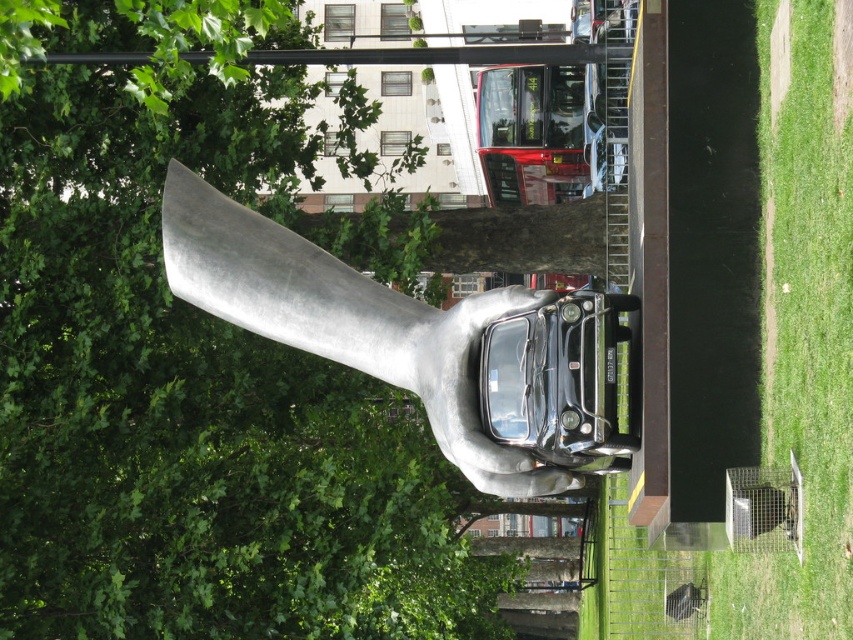
You are a drone operator planning to capture aerial footage of the public art installation. The drone has a maximum flight range of 30 meters. If you are positioned where the camera is, can the drone reach the green leafy tree at upper center to film it?

The distance between the green leafy tree at upper center and the camera is 33.32 meters, which exceeds the drone maximum flight range of 30 meters. Therefore, the drone cannot reach the green leafy tree at upper center.

Consider the image. You are a photographer standing at the camera position. You want to take a photo of the large metallic sculpture of a hand holding a vintage car and the green grass at lower right in the same frame. However, your camera has a maximum focus range of 25 meters. Will both objects be in focus?

The green grass at lower right is 25.26 meters away from camera, which exceeds the camera maximum focus range of 25 meters. Therefore, the green grass at lower right will be out of focus while the sculpture is within range, so both cannot be in focus simultaneously.

You are a photographer trying to capture the shiny silver hand at center holding the vintage car while also including the green leafy tree at upper center in the frame. Based on their positions, which object should you adjust your camera angle to focus on first to ensure both are in the shot?

The green leafy tree at upper center is positioned on the left side of the shiny silver hand at center, so you should adjust your camera angle to focus on the shiny silver hand at center first to ensure both objects are included in the frame.